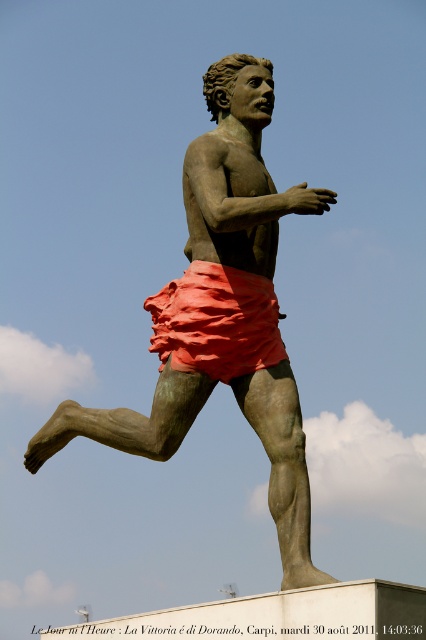
Question: Which point is farther to the camera?

Choices:
 (A) matte orange fabric shorts at center
 (B) bronze statue at center

Answer: (A)

Question: Among these points, which one is nearest to the camera?

Choices:
 (A) (221, 147)
 (B) (276, 320)

Answer: (B)

Question: In this image, where is bronze statue at center located relative to matte orange fabric shorts at center?

Choices:
 (A) left
 (B) right

Answer: (A)

Question: Is bronze statue at center smaller than matte orange fabric shorts at center?

Choices:
 (A) no
 (B) yes

Answer: (A)

Question: Which of the following is the closest to the observer?

Choices:
 (A) (55, 448)
 (B) (203, 305)

Answer: (B)

Question: Is bronze statue at center closer to the viewer compared to matte orange fabric shorts at center?

Choices:
 (A) no
 (B) yes

Answer: (B)